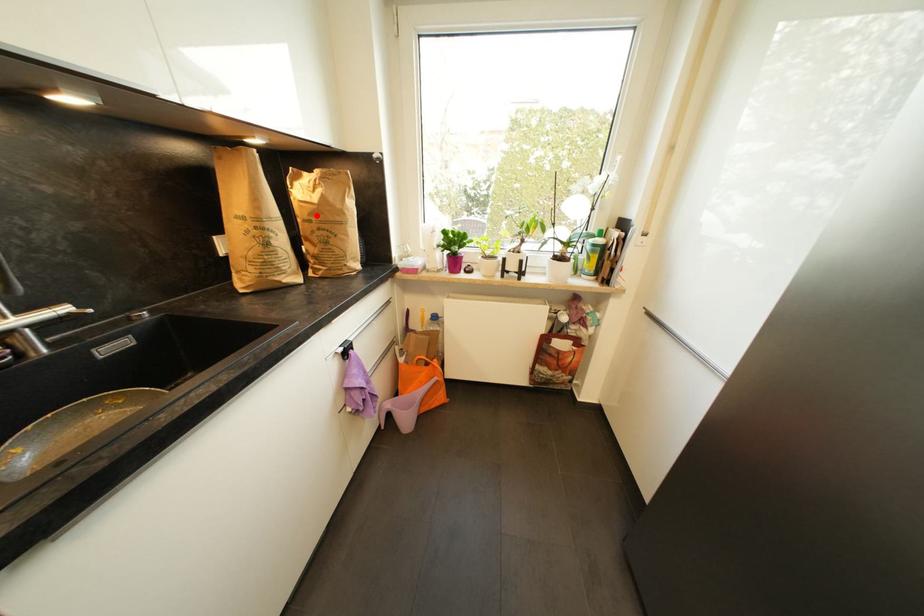
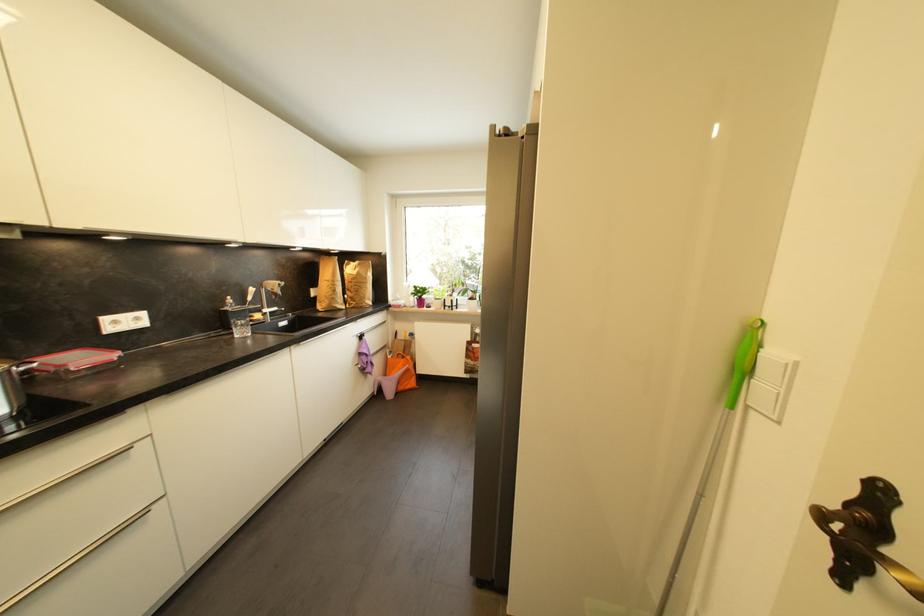
Question: I am providing you with two images of the same scene from different viewpoints. A red point is shown in image1. For the corresponding object point in image2, is it positioned nearer or farther from the camera?

Choices:
 (A) Nearer
 (B) Farther

Answer: (A)